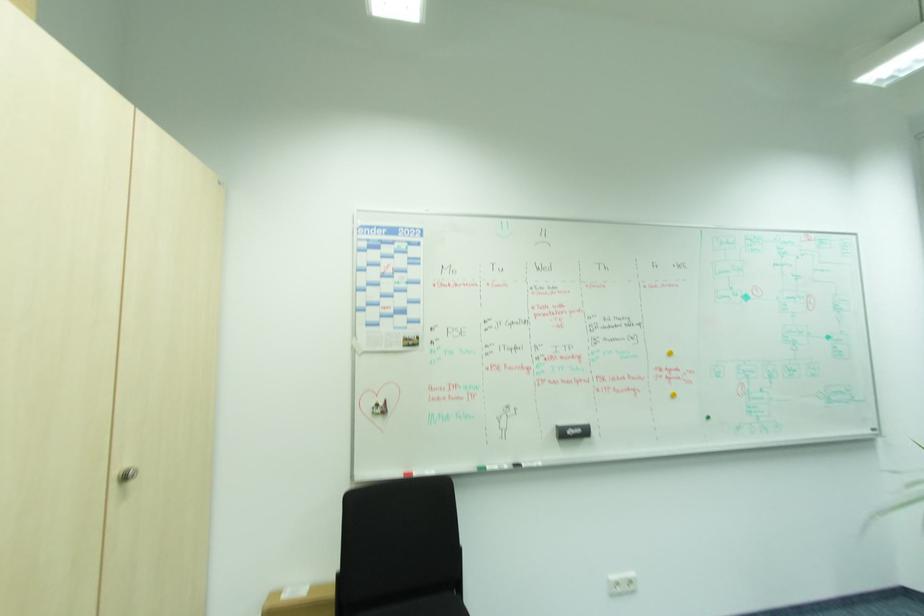
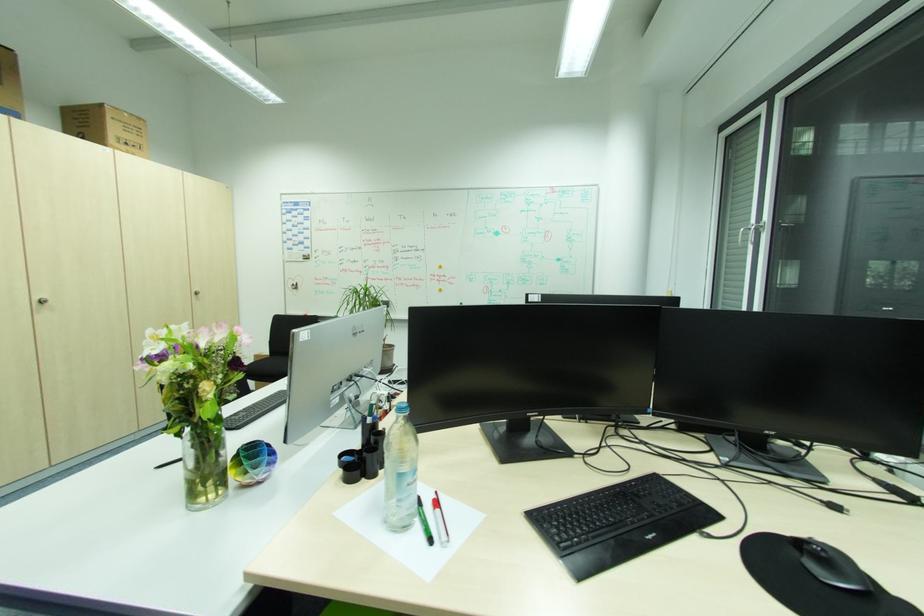
Which direction would the cameraman need to move to produce the second image?

The movement direction of the cameraman is right, backward.